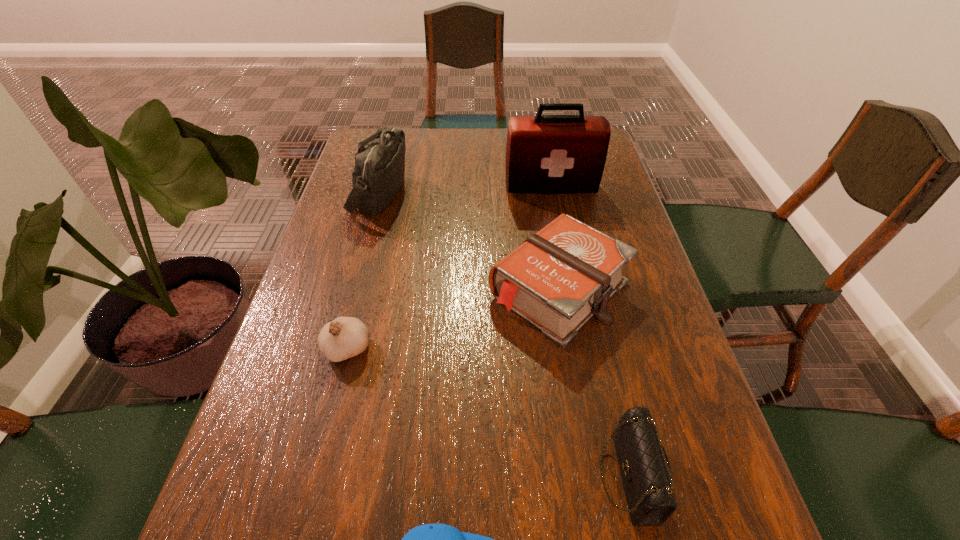
Find the location of a particular element. Image resolution: width=960 pixels, height=540 pixels. the tallest object is located at coordinates (545, 154).

Locate an element on the screen. This screenshot has width=960, height=540. shoulder bag is located at coordinates (378, 174).

This screenshot has height=540, width=960. Find the location of `Bible`. Bible is located at coordinates (557, 279).

Find the location of a particular element. clutch bag is located at coordinates (645, 471).

This screenshot has width=960, height=540. Find the location of `garlic`. garlic is located at coordinates (345, 337).

Find the location of a particular element. This screenshot has height=540, width=960. free location located on the side of the first aid kit with the cross symbol is located at coordinates (570, 289).

Where is `vacant space located at the front padded panel of the fifth shortest object`? The image size is (960, 540). vacant space located at the front padded panel of the fifth shortest object is located at coordinates (499, 193).

Where is `free space located on the back of the Bible`? This screenshot has height=540, width=960. free space located on the back of the Bible is located at coordinates click(x=539, y=169).

Where is `free point located on the front flap of the fifth farthest object`? Image resolution: width=960 pixels, height=540 pixels. free point located on the front flap of the fifth farthest object is located at coordinates (553, 477).

Find the location of a particular element. The image size is (960, 540). vacant region located on the front flap of the fifth farthest object is located at coordinates (523, 477).